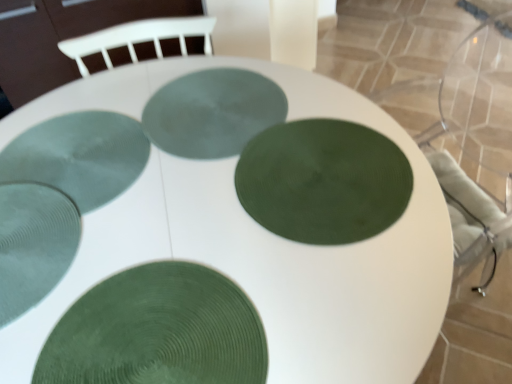
Find the location of `vacant area that lies to the right of green textured glass plate at center, which is the 1th glass plate in back-to-front order`. vacant area that lies to the right of green textured glass plate at center, which is the 1th glass plate in back-to-front order is located at coordinates (333, 124).